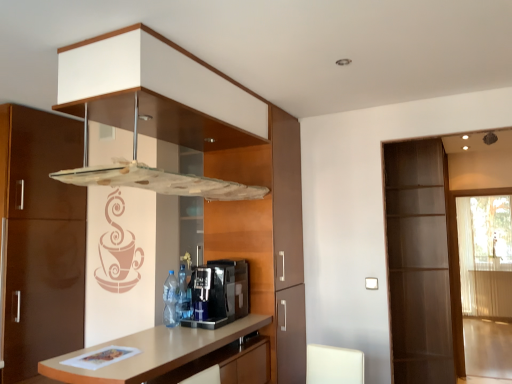
The image size is (512, 384). I want to click on free point in front of blue plastic bottle at center, which is the second bottle from back to front, so click(167, 332).